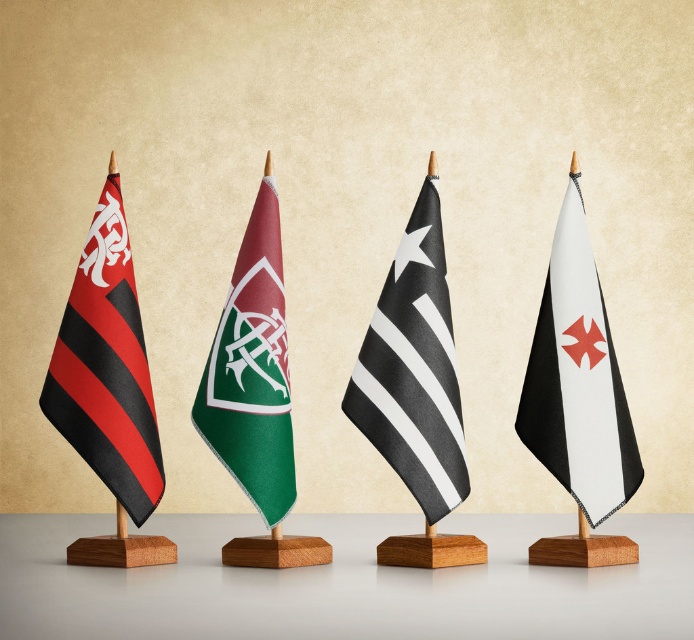
Question: Estimate the real-world distances between objects in this image. Which object is closer to the matte black and red striped flag at left?

Choices:
 (A) black/white striped flag at center
 (B) green fabric flag at center

Answer: (B)

Question: Among these objects, which one is farthest from the camera?

Choices:
 (A) black matte flag at right
 (B) green fabric flag at center

Answer: (B)

Question: Is black/white striped flag at center smaller than black matte flag at right?

Choices:
 (A) no
 (B) yes

Answer: (B)

Question: Which object appears farthest from the camera in this image?

Choices:
 (A) black/white striped flag at center
 (B) matte black and red striped flag at left

Answer: (B)

Question: Is black/white striped flag at center smaller than matte black and red striped flag at left?

Choices:
 (A) no
 (B) yes

Answer: (A)

Question: Is black/white striped flag at center closer to camera compared to matte black and red striped flag at left?

Choices:
 (A) yes
 (B) no

Answer: (A)